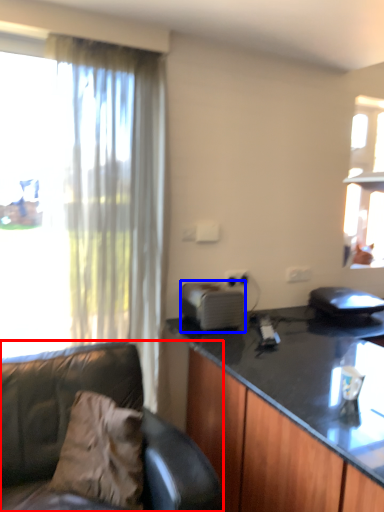
Question: Which of the following is the farthest to the observer, studio couch (highlighted by a red box) or appliance (highlighted by a blue box)?

Choices:
 (A) studio couch
 (B) appliance

Answer: (B)